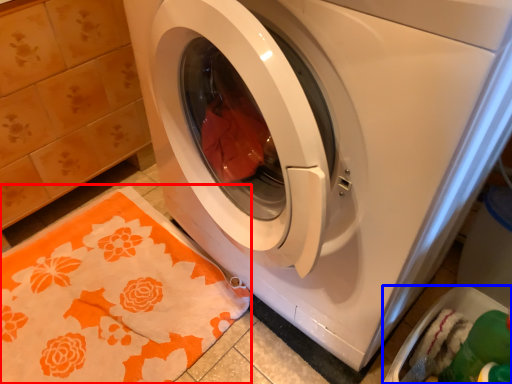
Question: Which object appears closest to the camera in this image, blanket (highlighted by a red box) or dish washer (highlighted by a blue box)?

Choices:
 (A) blanket
 (B) dish washer

Answer: (B)